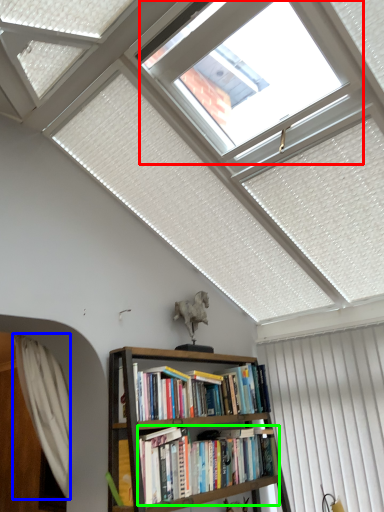
Question: Which object is the closest to the bay window (highlighted by a red box)? Choose among these: curtain (highlighted by a blue box) or book (highlighted by a green box).

Choices:
 (A) curtain
 (B) book

Answer: (B)